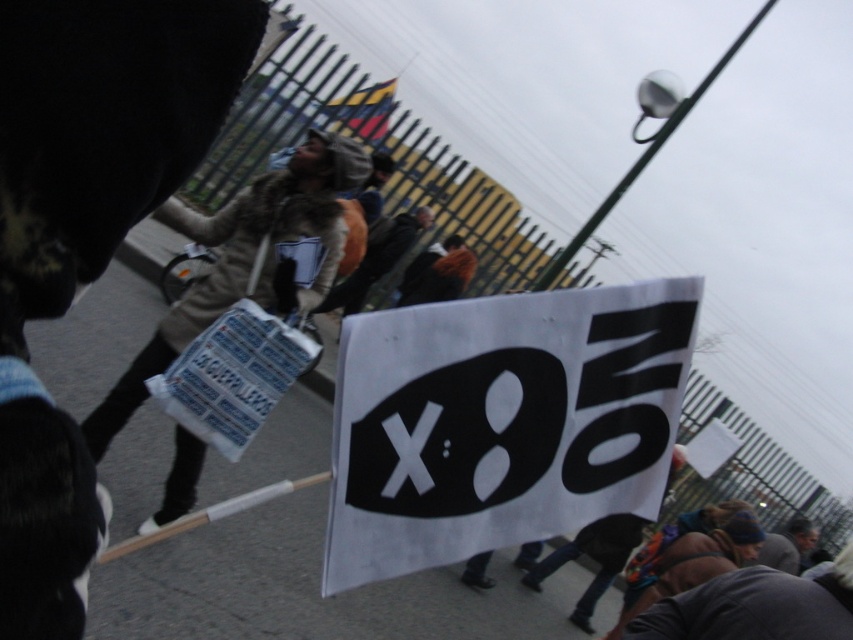
Is the position of white paper sign at center less distant than that of dark gray fabric cap at lower right?

That is True.

Describe the element at coordinates (502, 420) in the screenshot. I see `white paper sign at center` at that location.

Who is more forward, (416, 392) or (782, 563)?

Point (416, 392)

At what (x,y) coordinates should I click in order to perform the action: click on white paper sign at center. Please return your answer as a coordinate pair (x, y). Image resolution: width=853 pixels, height=640 pixels. Looking at the image, I should click on (502, 420).

Is beige fur coat at center smaller than brown fur coat at center?

Indeed, beige fur coat at center has a smaller size compared to brown fur coat at center.

Is point (297, 154) closer to camera compared to point (335, 300)?

Yes, it is.

Where is `beige fur coat at center`? The width and height of the screenshot is (853, 640). beige fur coat at center is located at coordinates (242, 260).

Between point (369, 556) and point (329, 186), which one is positioned behind?

The point (329, 186) is more distant.

Between white paper sign at center and beige fur coat at center, which one appears on the right side from the viewer's perspective?

white paper sign at center is more to the right.

Is point (515, 358) in front of point (289, 232)?

Yes, it is in front of point (289, 232).

Where is `white paper sign at center`? The image size is (853, 640). white paper sign at center is located at coordinates (502, 420).